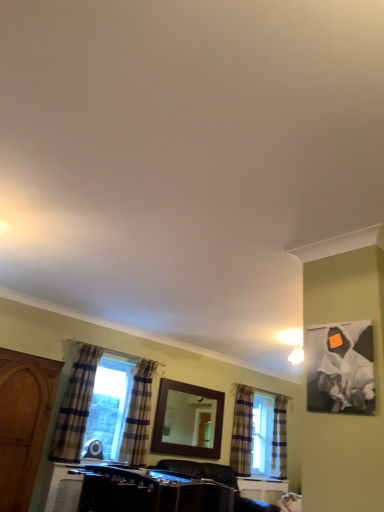
Question: Is wooden cabinet at left positioned far away from black canvas painting at upper right?

Choices:
 (A) yes
 (B) no

Answer: (A)

Question: Considering the relative sizes of wooden cabinet at left and black canvas painting at upper right in the image provided, is wooden cabinet at left taller than black canvas painting at upper right?

Choices:
 (A) no
 (B) yes

Answer: (B)

Question: Is wooden cabinet at left placed right next to black canvas painting at upper right?

Choices:
 (A) yes
 (B) no

Answer: (B)

Question: Is the position of wooden cabinet at left more distant than that of black canvas painting at upper right?

Choices:
 (A) no
 (B) yes

Answer: (B)

Question: Is wooden cabinet at left completely or partially outside of black canvas painting at upper right?

Choices:
 (A) no
 (B) yes

Answer: (B)

Question: Could you tell me if wooden cabinet at left is turned towards black canvas painting at upper right?

Choices:
 (A) no
 (B) yes

Answer: (B)

Question: From a real-world perspective, is wooden cabinet at left located beneath plaid fabric curtain at right, the 4th curtain viewed from the front?

Choices:
 (A) yes
 (B) no

Answer: (A)

Question: Does wooden cabinet at left have a larger size compared to plaid fabric curtain at right, the 4th curtain viewed from the front?

Choices:
 (A) yes
 (B) no

Answer: (A)

Question: Is wooden cabinet at left at the left side of plaid fabric curtain at right, the 4th curtain viewed from the front?

Choices:
 (A) yes
 (B) no

Answer: (A)

Question: Is wooden cabinet at left positioned with its back to plaid fabric curtain at right, acting as the 1th curtain starting from the right?

Choices:
 (A) no
 (B) yes

Answer: (A)

Question: From the image's perspective, does wooden cabinet at left appear higher than plaid fabric curtain at right, the first curtain when ordered from back to front?

Choices:
 (A) yes
 (B) no

Answer: (A)

Question: Does wooden cabinet at left have a lesser width compared to plaid fabric curtain at right, which ranks as the 4th curtain in left-to-right order?

Choices:
 (A) yes
 (B) no

Answer: (B)

Question: Is plaid fabric curtain at right, the 2th curtain from the back, facing away from plaid fabric curtain at lower left, arranged as the third curtain when viewed from the back?

Choices:
 (A) yes
 (B) no

Answer: (B)